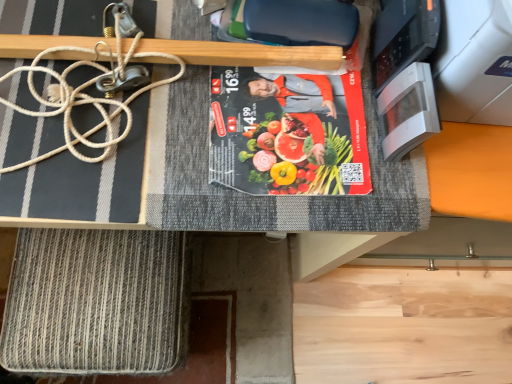
I want to click on free space above matte black book at center (from a real-world perspective), so click(283, 105).